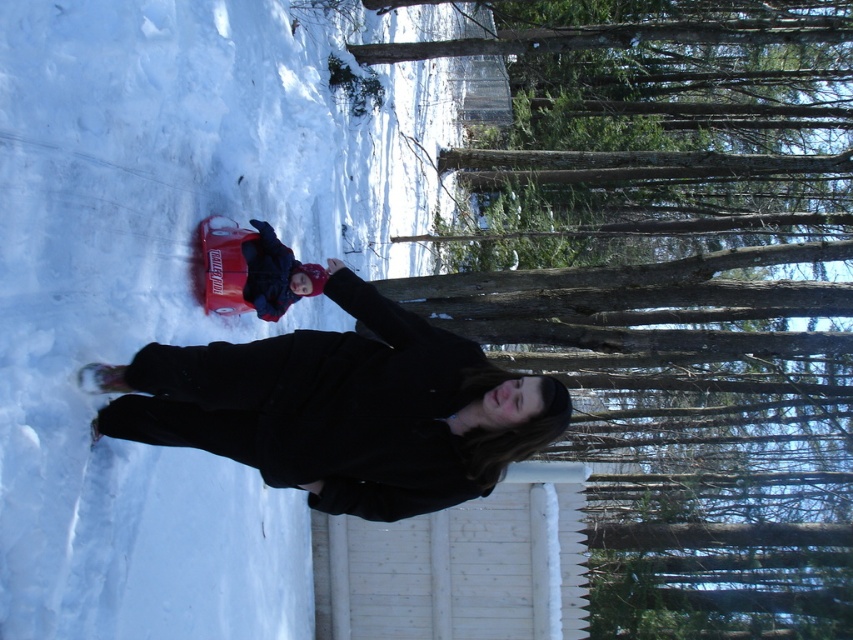
This screenshot has width=853, height=640. Describe the element at coordinates (178, 282) in the screenshot. I see `white fluffy snow at center` at that location.

Which of these two, white fluffy snow at center or black woolen coat at center, stands taller?

white fluffy snow at center is taller.

You are a GUI agent. You are given a task and a screenshot of the screen. Output one action in this format:
    pyautogui.click(x=<x>, y=<y>)
    Task: Click on the white fluffy snow at center
    
    Given the screenshot: What is the action you would take?
    pyautogui.click(x=178, y=282)